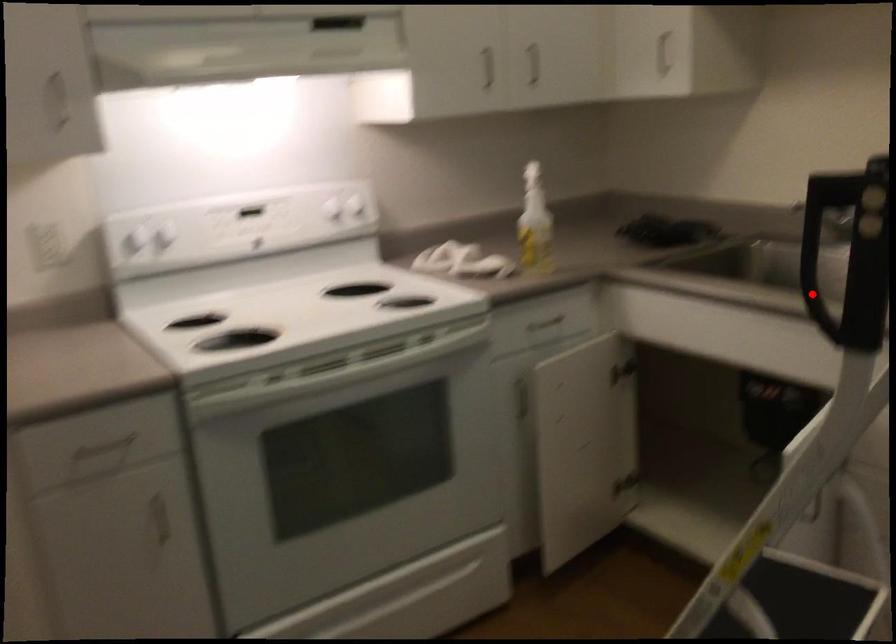
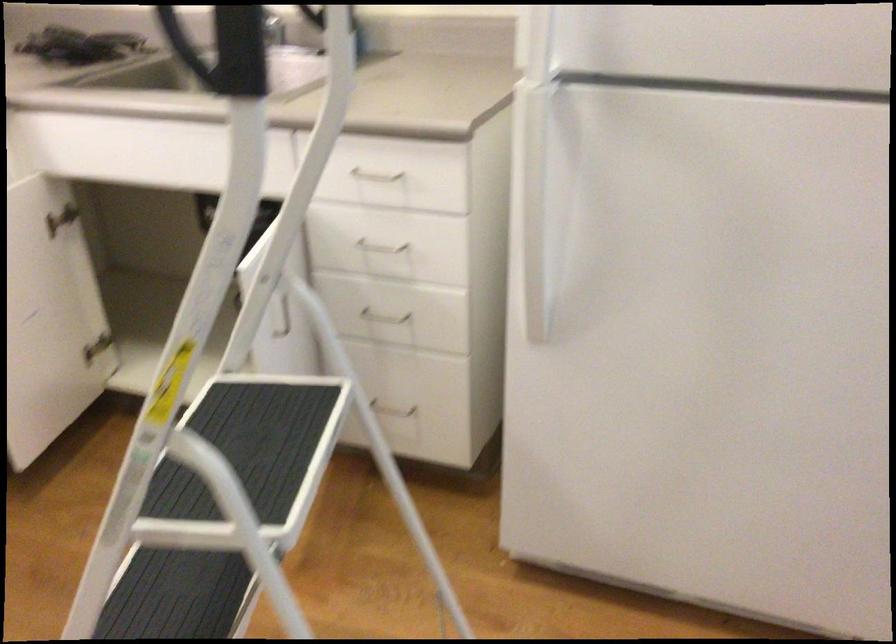
The point at the highlighted location is marked in the first image. Where is the corresponding point in the second image?

(186, 49)